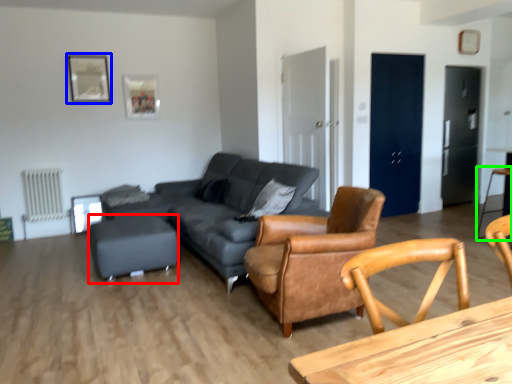
Question: Considering the real-world distances, which object is farthest from bar stool (highlighted by a red box)? picture frame (highlighted by a blue box) or bar stool (highlighted by a green box)?

Choices:
 (A) picture frame
 (B) bar stool

Answer: (B)